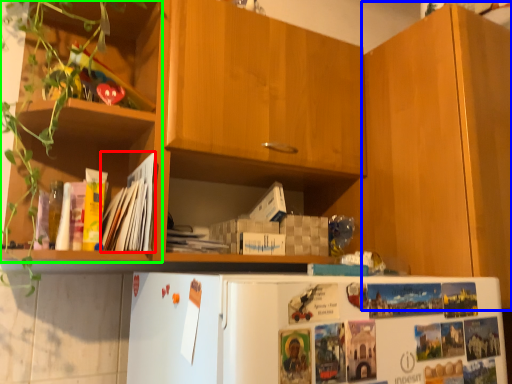
Question: Considering the real-world distances, which object is farthest from magazine (highlighted by a red box)? cabinetry (highlighted by a blue box) or shelf (highlighted by a green box)?

Choices:
 (A) cabinetry
 (B) shelf

Answer: (A)